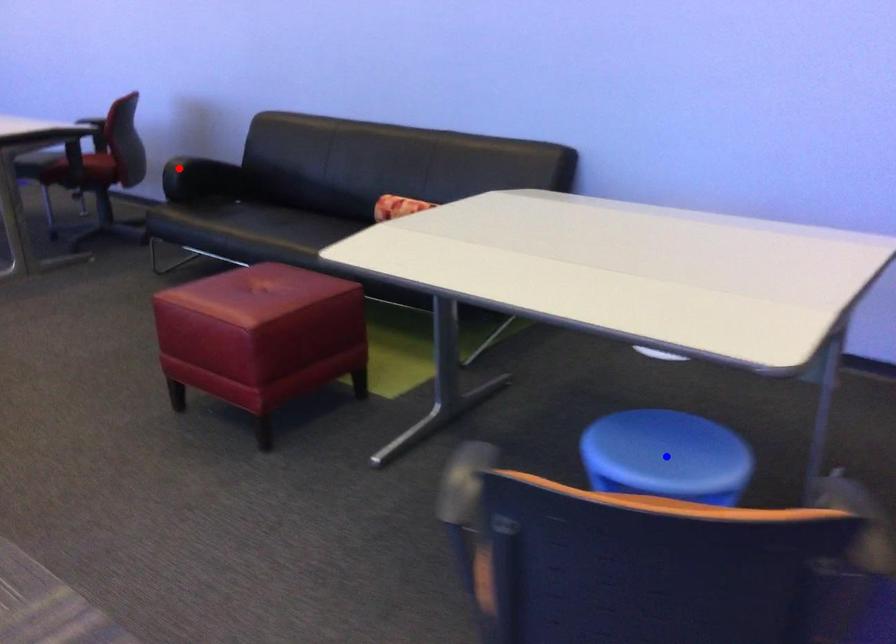
Question: In the image, two points are highlighted. Which point is nearer to the camera? Reply with the corresponding letter.

Choices:
 (A) blue point
 (B) red point

Answer: (A)